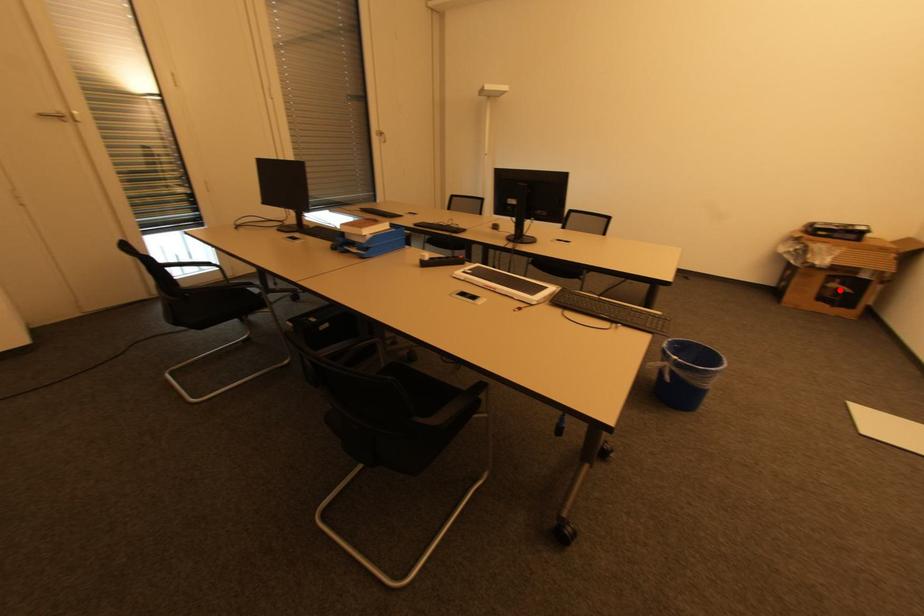
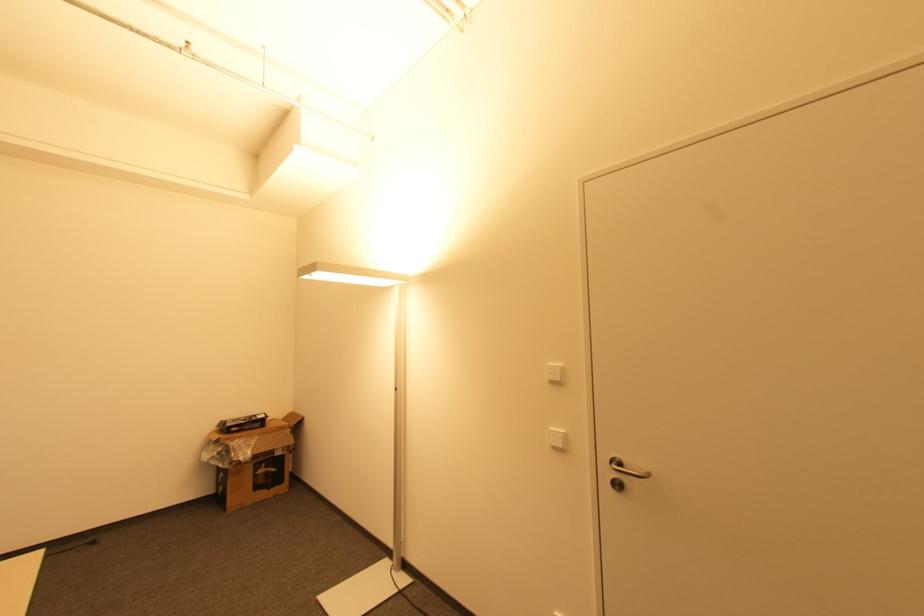
Where in the second image is the point corresponding to the highlighted location from the first image?

(268, 472)